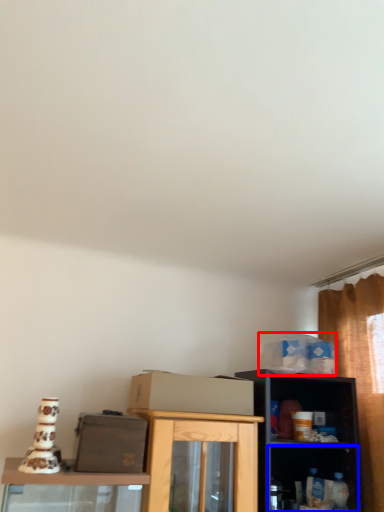
Question: Which point is further to the camera, box (highlighted by a red box) or shelf (highlighted by a blue box)?

Choices:
 (A) box
 (B) shelf

Answer: (A)